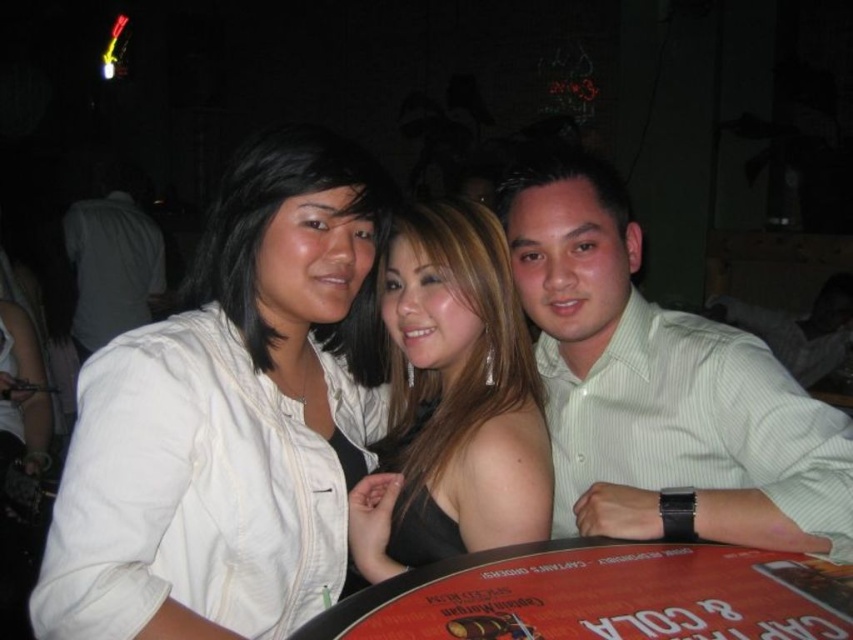
Between point (764, 362) and point (401, 369), which one is positioned behind?

Positioned behind is point (401, 369).

Between green striped shirt at right and shiny black dress at center, which one has less height?

Standing shorter between the two is shiny black dress at center.

Measure the distance between point (543, 332) and camera.

A distance of 4.56 feet exists between point (543, 332) and camera.

Identify the location of green striped shirt at right. (660, 387).

From the picture: Is wooden table at center to the right of white shirt at left from the viewer's perspective?

Correct, you'll find wooden table at center to the right of white shirt at left.

The width and height of the screenshot is (853, 640). What do you see at coordinates (602, 595) in the screenshot? I see `wooden table at center` at bounding box center [602, 595].

The height and width of the screenshot is (640, 853). Identify the location of wooden table at center. (602, 595).

Is point (345, 531) behind point (496, 220)?

No, (345, 531) is in front of (496, 220).

Can you confirm if white matte jacket at upper left is positioned to the right of shiny black dress at center?

No, white matte jacket at upper left is not to the right of shiny black dress at center.

What do you see at coordinates (231, 417) in the screenshot? This screenshot has height=640, width=853. I see `white matte jacket at upper left` at bounding box center [231, 417].

You are a GUI agent. You are given a task and a screenshot of the screen. Output one action in this format:
    pyautogui.click(x=<x>, y=<y>)
    Task: Click on the white matte jacket at upper left
    Image resolution: width=853 pixels, height=640 pixels.
    Given the screenshot: What is the action you would take?
    pyautogui.click(x=231, y=417)